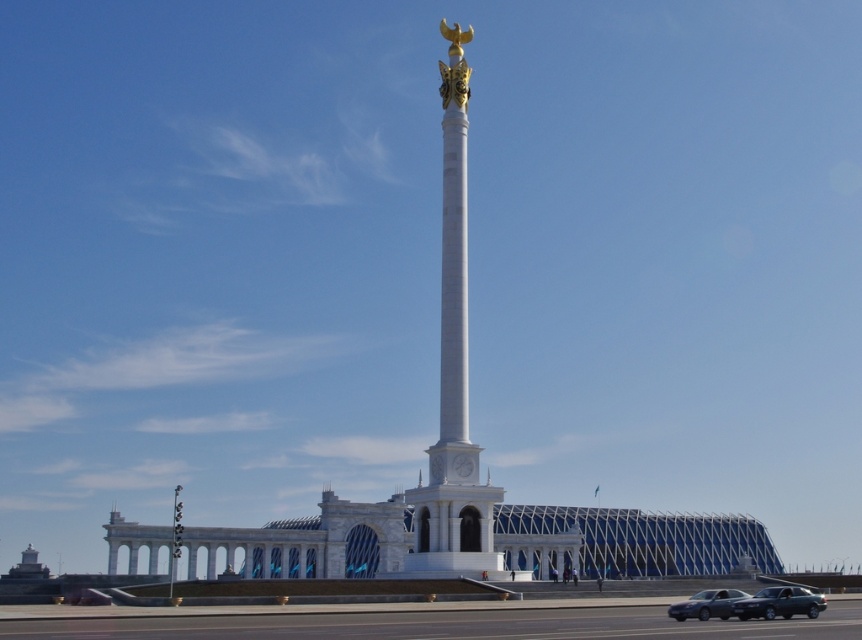
Question: Does metallic gray sedan at lower right appear on the right side of silver metallic sedan at lower right?

Choices:
 (A) no
 (B) yes

Answer: (B)

Question: Which point is closer to the camera?

Choices:
 (A) (426, 536)
 (B) (688, 602)
 (C) (773, 595)

Answer: (C)

Question: Is metallic gray sedan at lower right positioned before silver metallic sedan at lower right?

Choices:
 (A) yes
 (B) no

Answer: (A)

Question: Considering the real-world distances, which object is farthest from the silver metallic sedan at lower right?

Choices:
 (A) metallic gray sedan at lower right
 (B) white marble column at center

Answer: (B)

Question: Where is white marble column at center located in relation to silver metallic sedan at lower right in the image?

Choices:
 (A) right
 (B) left

Answer: (B)

Question: Among these objects, which one is farthest from the camera?

Choices:
 (A) metallic gray sedan at lower right
 (B) silver metallic sedan at lower right

Answer: (B)